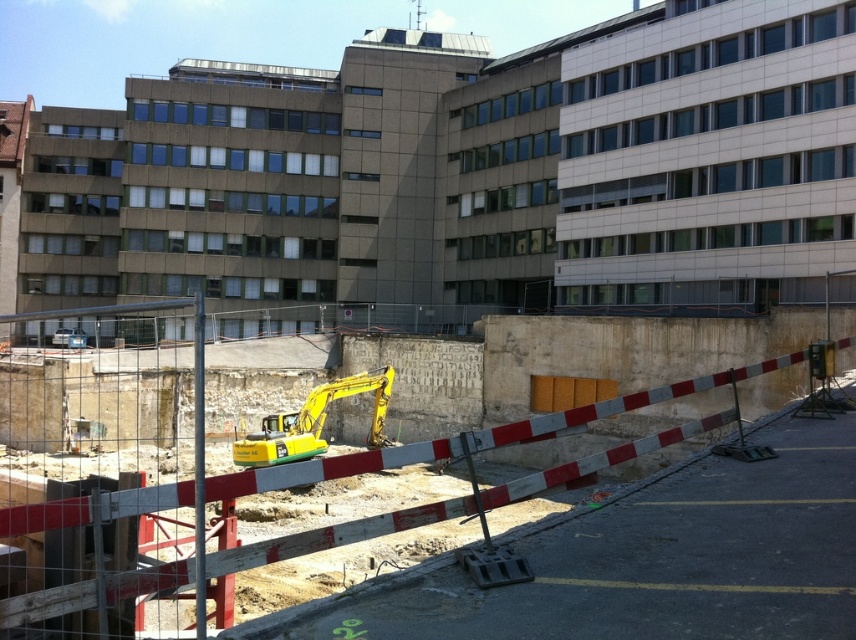
You are a construction worker standing at the point marked by the coordinates (177,508). Looking towards the temporary red and white striped barrier fence, which direction should you turn to face the yellow metal excavator at center?

The point marked by the coordinates (177,508) indicates the location of the yellow metal excavator at center. Therefore, you are already facing the excavator and do not need to turn.

You are a construction worker who needs to operate the yellow metal excavator at center and the yellow metallic excavator at center. Which one is taller?

The yellow metal excavator at center is much taller than the yellow metallic excavator at center.

You are a construction worker standing outside the fenced area. You see two yellow excavators in the image. Which one is closer to you, the yellow metal excavator at center or the yellow metallic excavator at center?

The yellow metal excavator at center is closer to you because it is in front of the yellow metallic excavator at center.